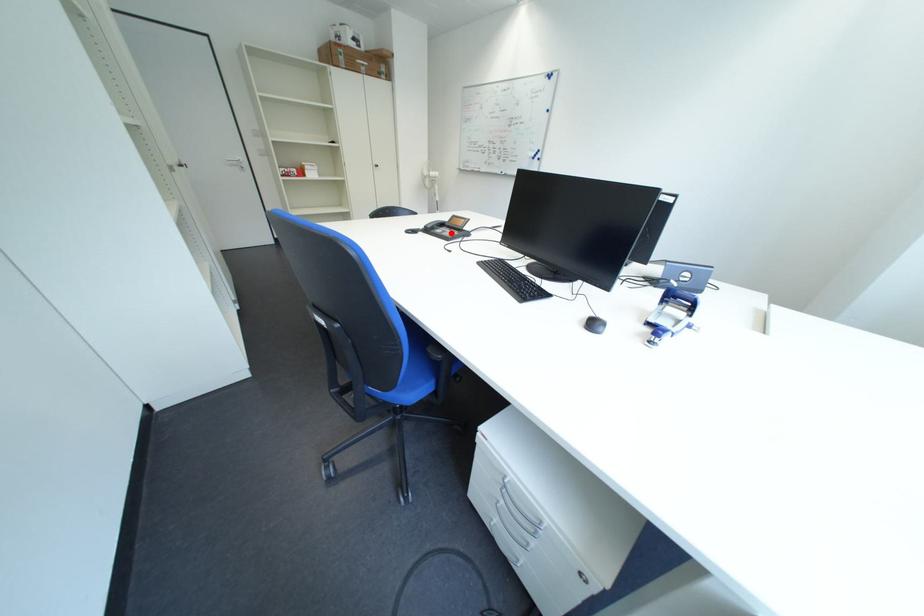
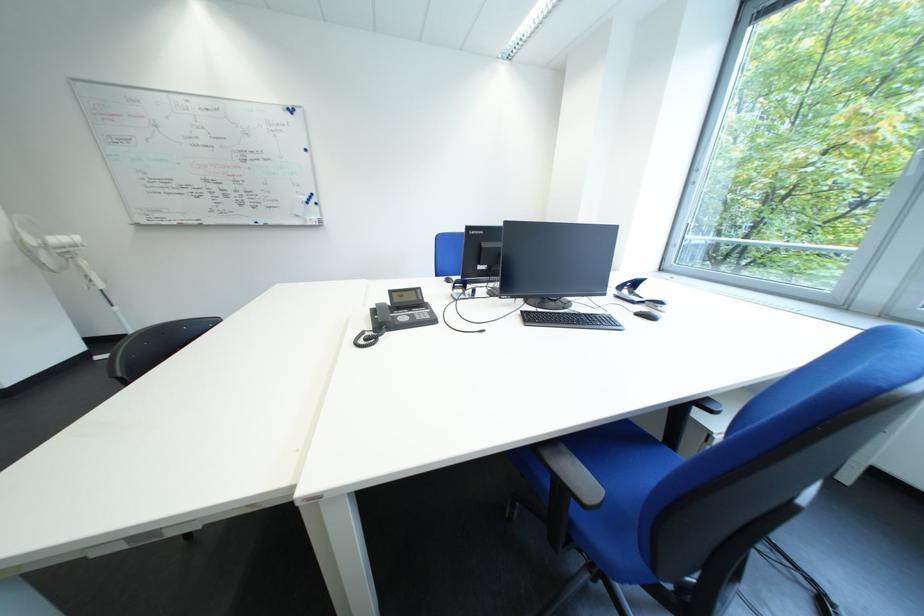
Find the pixel in the second image that matches the highlighted location in the first image.

(416, 320)